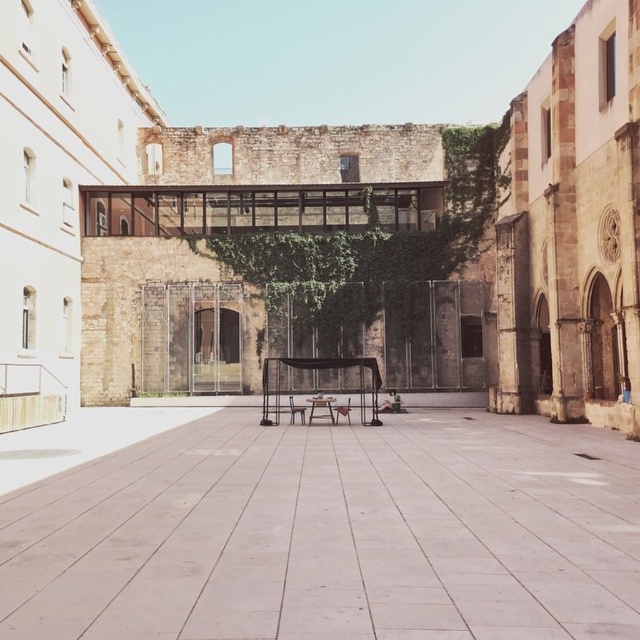
You are standing in the courtyard and want to place a potted plant on the wooden chair at center. However, there is a smooth concrete alley at center above it. Is there enough space to place the plant without it being blocked by the alley?

The smooth concrete alley at center is above the wooden chair at center, so placing the potted plant on the wooden chair at center would result in the plant being blocked by the alley above it.

You are standing in the courtyard and want to walk to the glass walkway on the wall. You see the smooth concrete alley at center and the wooden chair at center. Which object should you step over to reach the glass walkway?

The smooth concrete alley at center is in front of the wooden chair at center, so you should step over the wooden chair at center to reach the glass walkway.

You are standing in the courtyard and want to take a photo of the smooth concrete alley at center. Where should you position yourself to capture it in the frame?

You should position yourself at point (332, 534) to capture the smooth concrete alley at center in the frame.